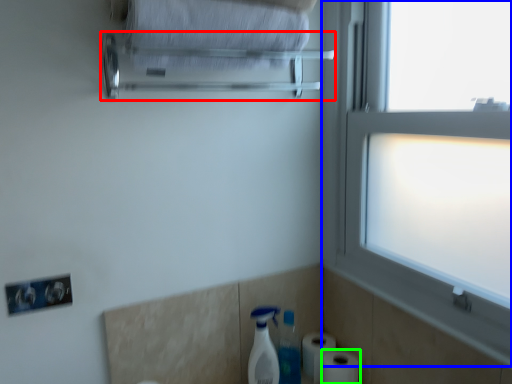
Question: Which object is positioned closest to towel bar (highlighted by a red box)? Select from window (highlighted by a blue box) and toilet paper (highlighted by a green box).

Choices:
 (A) window
 (B) toilet paper

Answer: (A)